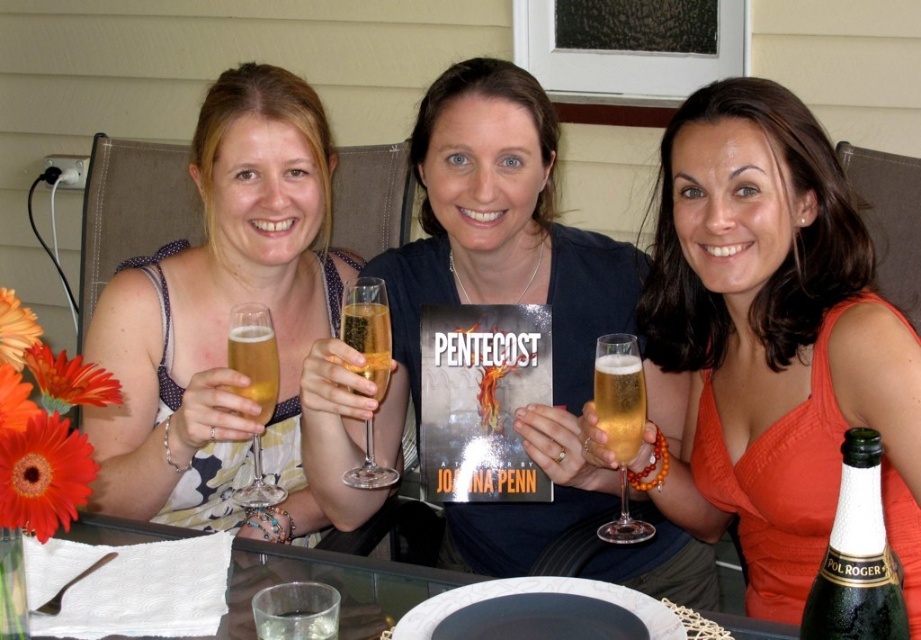
You are planning to sit between the orange fabric dress at center and the matte floral dress at center. Which side should you choose to avoid feeling cramped?

Choose the side of the orange fabric dress at center because it might be wider than the matte floral dress at center, providing more space.